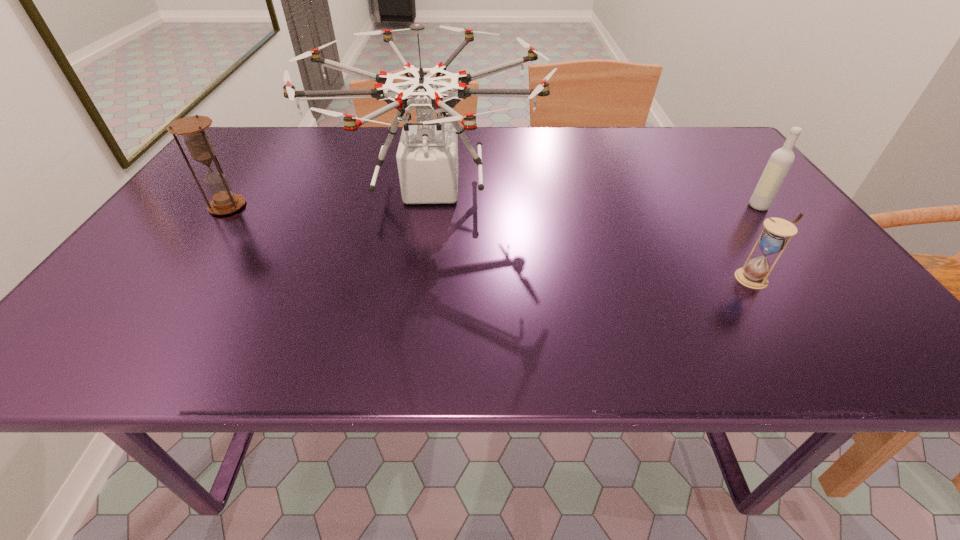
The width and height of the screenshot is (960, 540). I want to click on vacant area situated on the right of the nearest object, so click(x=822, y=278).

Find the location of a particular element. This screenshot has width=960, height=540. object that is at the far edge is located at coordinates (427, 157).

Locate an element on the screen. The image size is (960, 540). object that is at the left edge is located at coordinates (192, 128).

I want to click on vodka that is at the right edge, so click(x=781, y=160).

This screenshot has height=540, width=960. Identify the location of hourglass present at the right edge. (774, 238).

In order to click on vacant region at the far edge of the desktop in this screenshot , I will do `click(660, 149)`.

Where is `vacant space at the near edge of the desktop`? vacant space at the near edge of the desktop is located at coordinates (250, 361).

In the image, there is a desktop. Where is `vacant region at the left edge`? The height and width of the screenshot is (540, 960). vacant region at the left edge is located at coordinates (152, 291).

Locate an element on the screen. free location at the right edge of the desktop is located at coordinates (757, 231).

The width and height of the screenshot is (960, 540). Identify the location of free space at the near right corner of the desktop. (828, 342).